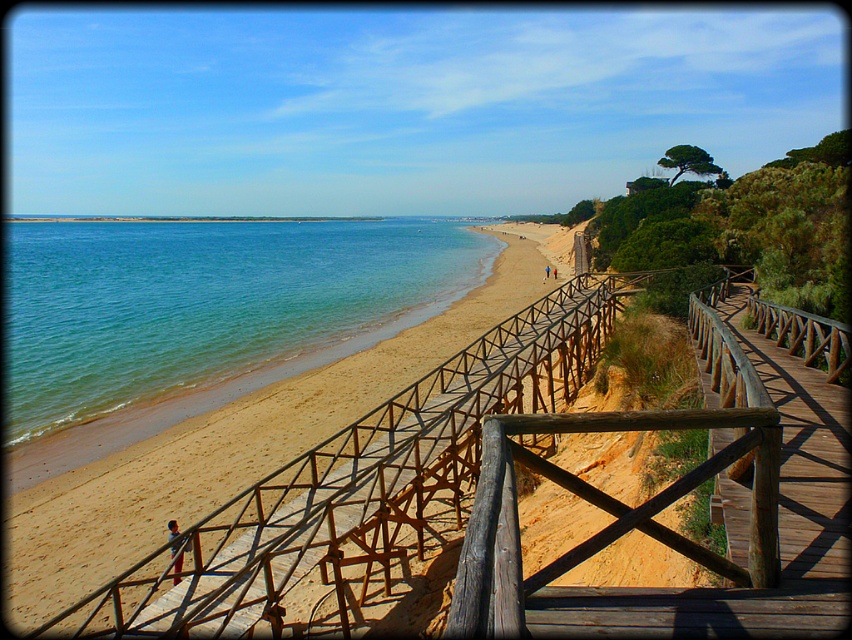
Question: Is greenish-blue water at beach left in front of sandy beach at center?

Choices:
 (A) no
 (B) yes

Answer: (A)

Question: Which object is closer to the camera taking this photo?

Choices:
 (A) sandy beach at center
 (B) greenish-blue water at beach left

Answer: (A)

Question: Is greenish-blue water at beach left to the left of sandy beach at center from the viewer's perspective?

Choices:
 (A) no
 (B) yes

Answer: (B)

Question: Can you confirm if greenish-blue water at beach left is smaller than sandy beach at center?

Choices:
 (A) yes
 (B) no

Answer: (B)